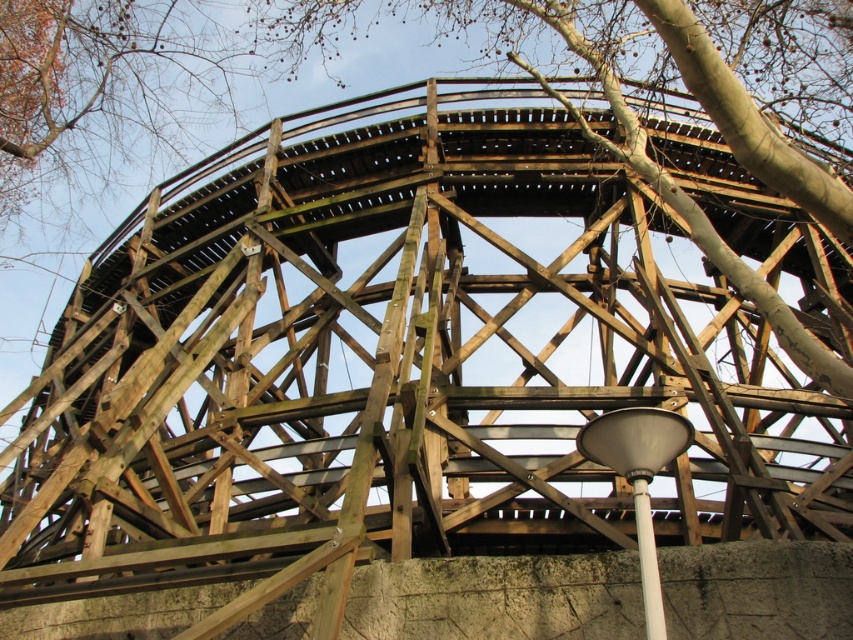
Question: Among these points, which one is farthest from the camera?

Choices:
 (A) (643, 604)
 (B) (842, 193)

Answer: (B)

Question: Which object is farther from the camera taking this photo?

Choices:
 (A) brown wood tree at center
 (B) white plastic pole at lower center

Answer: (A)

Question: Which of the following is the closest to the observer?

Choices:
 (A) white plastic pole at lower center
 (B) brown wood tree at center

Answer: (A)

Question: Where is brown wood tree at center located in relation to white plastic pole at lower center in the image?

Choices:
 (A) right
 (B) left

Answer: (A)

Question: Is brown wood tree at center to the right of white plastic pole at lower center from the viewer's perspective?

Choices:
 (A) yes
 (B) no

Answer: (A)

Question: Is brown wood tree at center behind white plastic pole at lower center?

Choices:
 (A) yes
 (B) no

Answer: (A)